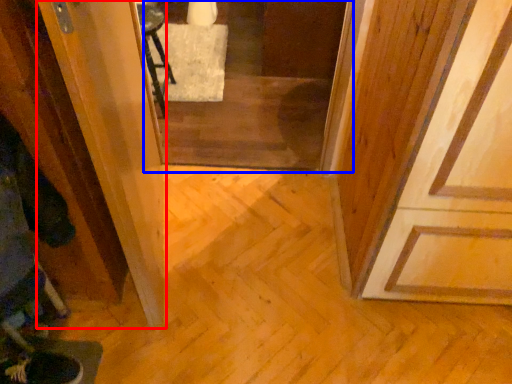
Question: Which of the following is the farthest to the observer, screen door (highlighted by a red box) or screen door (highlighted by a blue box)?

Choices:
 (A) screen door
 (B) screen door

Answer: (B)